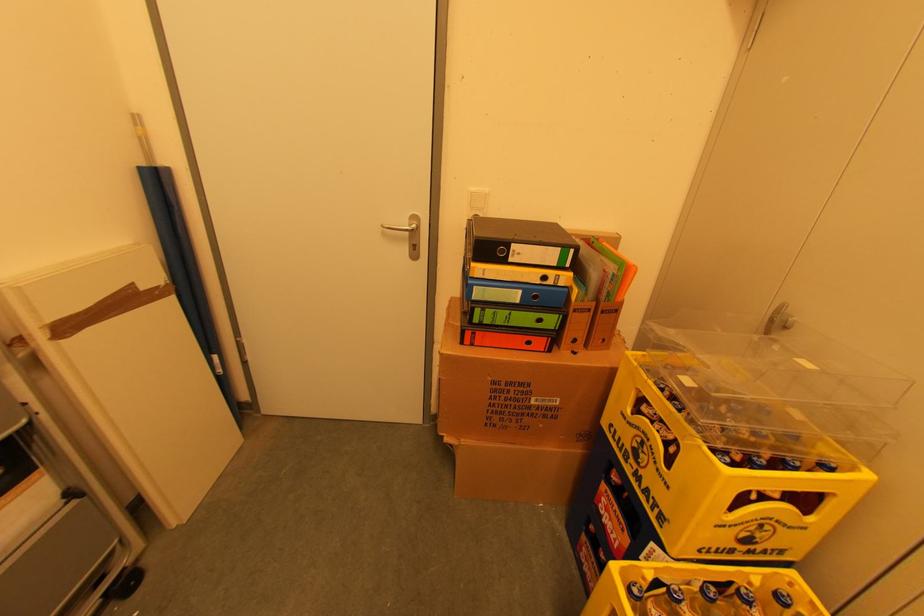
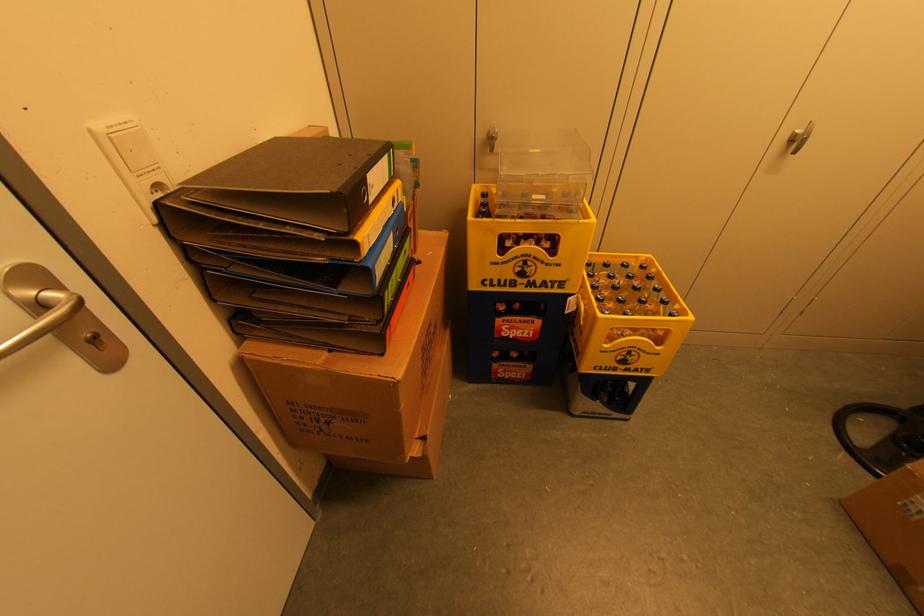
Find the pixel in the second image that matches (606,487) in the first image.

(501, 322)